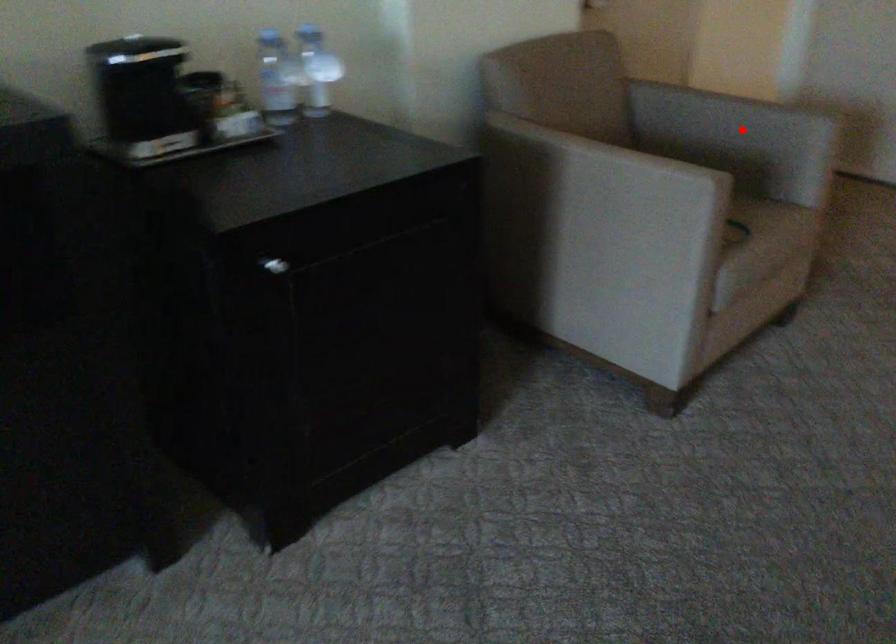
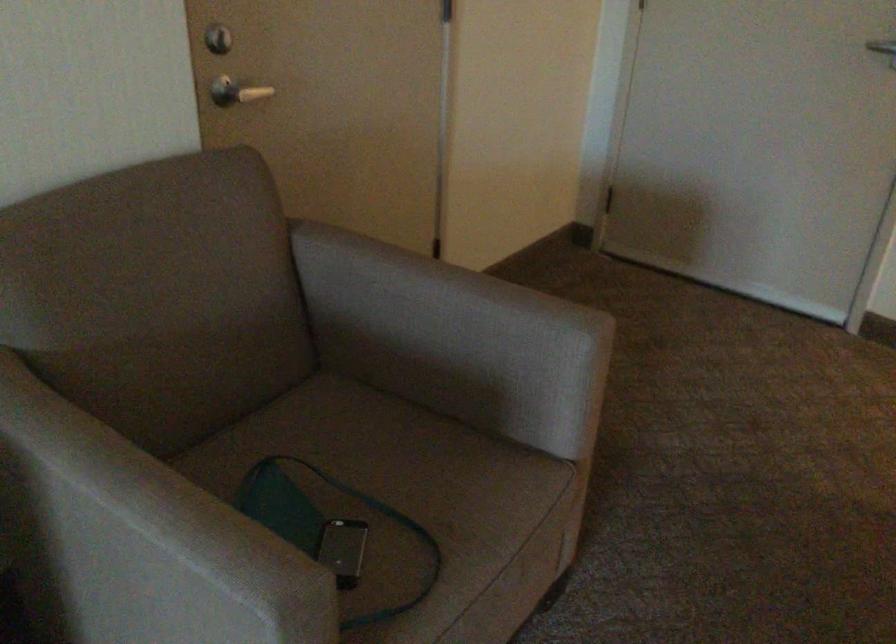
Question: A red point is marked in image1. In image2, is the corresponding 3D point closer to the camera or farther? Reply with the corresponding letter.

Choices:
 (A) The corresponding 3D point is closer.
 (B) The corresponding 3D point is farther.

Answer: (A)